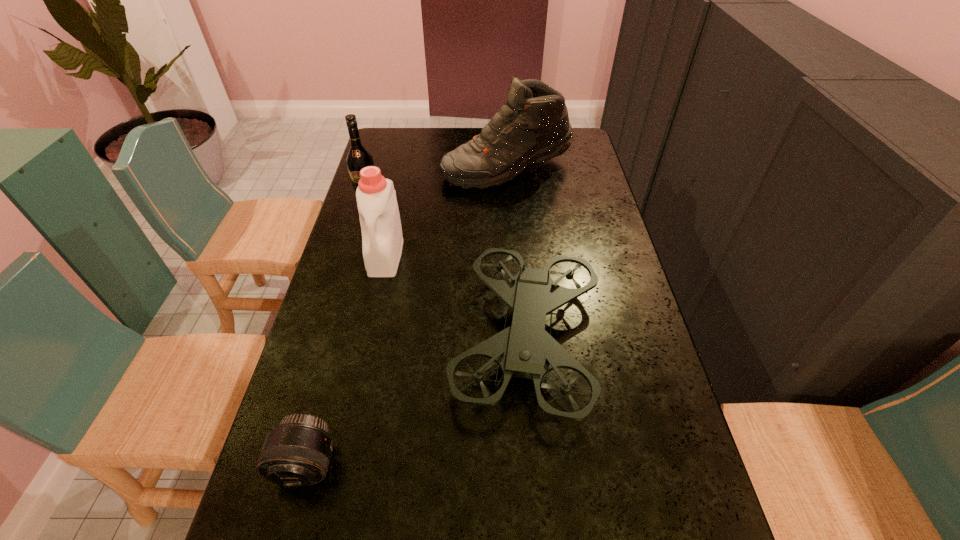
I want to click on vacant region at the far left corner of the desktop, so click(x=377, y=134).

The width and height of the screenshot is (960, 540). In order to click on vacant region between the telephoto lens and the detergent in this screenshot , I will do `click(347, 360)`.

Find the location of a particular element. Image resolution: width=960 pixels, height=540 pixels. free area in between the shortest object and the detergent is located at coordinates (347, 360).

Identify the location of unoccupied area between the fourth nearest object and the fourth tallest object. (447, 269).

I want to click on vacant area between the nearest object and the detergent, so click(347, 360).

Where is `vacant space in between the nearest object and the detergent`? vacant space in between the nearest object and the detergent is located at coordinates (347, 360).

Find the location of a particular element. Image resolution: width=960 pixels, height=540 pixels. vacant space that's between the drone and the detergent is located at coordinates (456, 298).

You are a GUI agent. You are given a task and a screenshot of the screen. Output one action in this format:
    pyautogui.click(x=<x>, y=<y>)
    Task: Click on the free space that is in between the telephoto lens and the detergent
    This screenshot has height=540, width=960.
    Given the screenshot: What is the action you would take?
    pyautogui.click(x=347, y=360)

At what (x,y) coordinates should I click in order to perform the action: click on free space between the shortest object and the second shortest object. Please return your answer as a coordinate pair (x, y). The width and height of the screenshot is (960, 540). Looking at the image, I should click on (417, 402).

Identify which object is the second closest to the fourth tallest object. Please provide its 2D coordinates. Your answer should be formatted as a tuple, i.e. [(x, y)], where the tuple contains the x and y coordinates of a point satisfying the conditions above.

[(297, 452)]